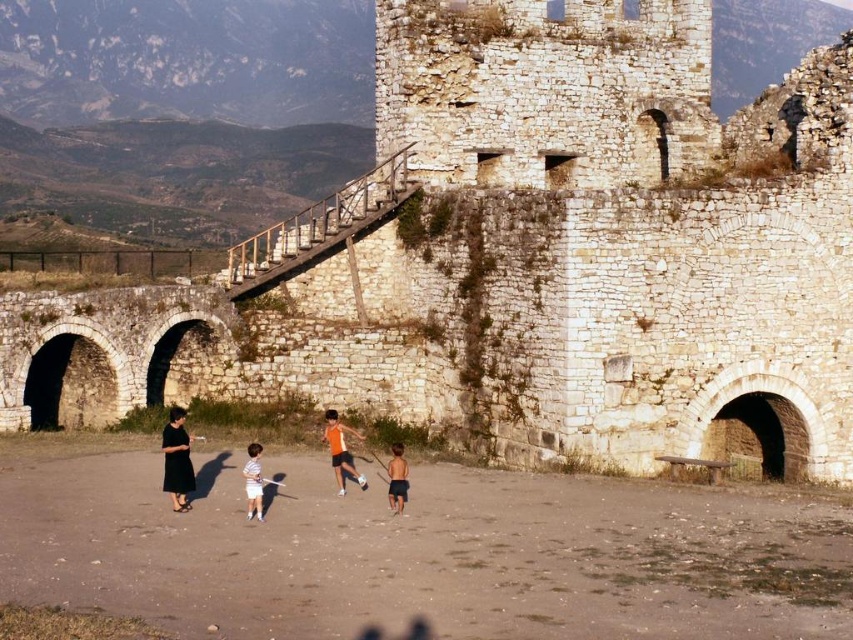
You are planning to take a photo of the black dress at lower left and the orange fabric shirt at center. Which one should you zoom in on to capture more details without moving the camera?

The black dress at lower left has a greater width than the orange fabric shirt at center, so zooming in on the black dress at lower left would allow you to capture more details without moving the camera.

You are a tourist visiting the historical stone structure and want to take a photo of the orange fabric shirt at center and the dark blue shorts at center. Which object should you focus on first if you want to capture both in a single frame without moving the camera?

You should focus on the orange fabric shirt at center first because it is larger in size than the dark blue shorts at center, making it easier to ensure it is in frame while also capturing the smaller dark blue shorts at center.

You are planning to place a picnic blanket between the orange fabric shirt at center and the dark blue shorts at center. The blanket is 6 feet long. Will it fit between them?

The orange fabric shirt at center and dark blue shorts at center are 7.70 feet apart. Since the blanket is 6 feet long, it will fit between them with some space left over.